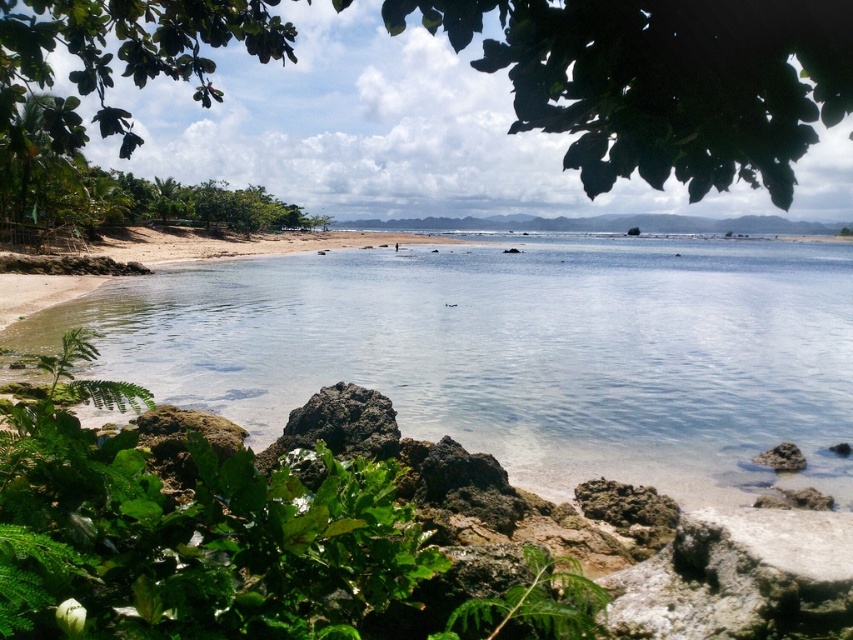
Question: Which point is closer to the camera?

Choices:
 (A) green leafy plant at lower left
 (B) brown rock at lower right

Answer: (A)

Question: Which point is closer to the camera taking this photo?

Choices:
 (A) (775, 76)
 (B) (558, 630)

Answer: (A)

Question: Does clear water at beach left come behind green leafy tree at upper center?

Choices:
 (A) no
 (B) yes

Answer: (B)

Question: Does green leafy tree at upper center have a lesser width compared to green leafy plant at lower left?

Choices:
 (A) no
 (B) yes

Answer: (A)

Question: Which point is closer to the camera taking this photo?

Choices:
 (A) tap(114, 67)
 (B) tap(799, 464)

Answer: (B)

Question: Is green leafy plant at lower left below brown rock at lower right?

Choices:
 (A) no
 (B) yes

Answer: (A)